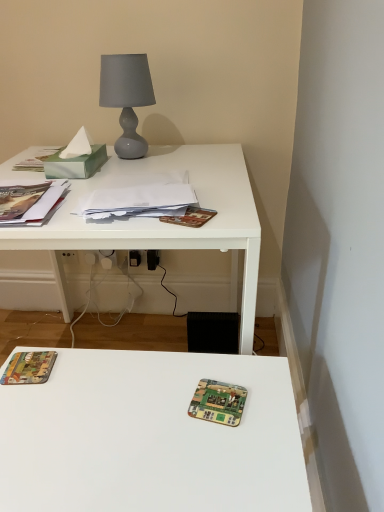
Question: Is point (117, 86) positioned closer to the camera than point (168, 217)?

Choices:
 (A) closer
 (B) farther

Answer: (B)

Question: From their relative heights in the image, would you say matte gray glass lamp at upper center is taller or shorter than brown textured paper at center, which is the first paperback book in right-to-left order?

Choices:
 (A) tall
 (B) short

Answer: (A)

Question: Which is farther from the hardcover book at lower left, positioned as the first paperback book in bottom-to-top order?

Choices:
 (A) green circuit board at center
 (B) white matte desk at upper left
 (C) brown textured paper at center, the first paperback book from the top
 (D) white paper stack at center
 (E) matte paper book at left

Answer: (B)

Question: Estimate the real-world distances between objects in this image. Which object is farther from the matte paper book at left?

Choices:
 (A) hardcover book at lower left, positioned as the first paperback book in bottom-to-top order
 (B) green circuit board at center
 (C) matte gray glass lamp at upper center
 (D) white matte desk at upper left
 (E) white paper stack at center

Answer: (B)